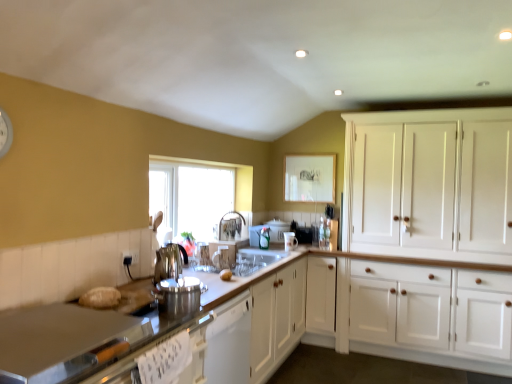
Question: Should I look upward or downward to see bread matte at center?

Choices:
 (A) up
 (B) down

Answer: (B)

Question: Is polished stainless steel kettle at center, arranged as the fifth appliance when viewed from the right, thinner than satin silver kettle at center, the 5th appliance from the back?

Choices:
 (A) yes
 (B) no

Answer: (A)

Question: Is polished stainless steel kettle at center, the fourth appliance viewed from the back, oriented away from satin silver kettle at center, acting as the first appliance starting from the front?

Choices:
 (A) yes
 (B) no

Answer: (B)

Question: Is polished stainless steel kettle at center, the first appliance when ordered from left to right, taller than satin silver kettle at center, acting as the second appliance starting from the left?

Choices:
 (A) no
 (B) yes

Answer: (B)

Question: Does polished stainless steel kettle at center, arranged as the fifth appliance when viewed from the right, come in front of satin silver kettle at center, acting as the second appliance starting from the left?

Choices:
 (A) no
 (B) yes

Answer: (A)

Question: Is polished stainless steel kettle at center, the fourth appliance viewed from the back, far away from satin silver kettle at center, acting as the second appliance starting from the left?

Choices:
 (A) yes
 (B) no

Answer: (B)

Question: Considering the relative sizes of polished stainless steel kettle at center, the fourth appliance viewed from the back, and satin silver kettle at center, the 5th appliance from the back, in the image provided, is polished stainless steel kettle at center, the fourth appliance viewed from the back, smaller than satin silver kettle at center, the 5th appliance from the back,?

Choices:
 (A) no
 (B) yes

Answer: (A)

Question: Is white glossy mug at center, positioned as the third appliance in front-to-back order, located outside white plastic toaster at center, the 3th appliance when ordered from right to left?

Choices:
 (A) no
 (B) yes

Answer: (B)

Question: Does white glossy mug at center, positioned as the third appliance in front-to-back order, appear on the right side of white plastic toaster at center, the third appliance viewed from the left?

Choices:
 (A) yes
 (B) no

Answer: (A)

Question: Is white glossy mug at center, marked as the second appliance in a right-to-left arrangement, at the left side of white plastic toaster at center, which is the 4th appliance from front to back?

Choices:
 (A) no
 (B) yes

Answer: (A)

Question: Is white glossy mug at center, the fourth appliance viewed from the left, positioned in front of white plastic toaster at center, the 3th appliance when ordered from right to left?

Choices:
 (A) yes
 (B) no

Answer: (A)

Question: Are white glossy mug at center, positioned as the third appliance in front-to-back order, and white plastic toaster at center, which is the 4th appliance from front to back, beside each other?

Choices:
 (A) yes
 (B) no

Answer: (B)

Question: Is white glossy mug at center, the fourth appliance viewed from the left, aimed at white plastic toaster at center, the 2th appliance when ordered from back to front?

Choices:
 (A) no
 (B) yes

Answer: (A)

Question: Is the position of clear glass window at center more distant than that of white plastic toaster at center, which is the 4th appliance from front to back?

Choices:
 (A) no
 (B) yes

Answer: (A)